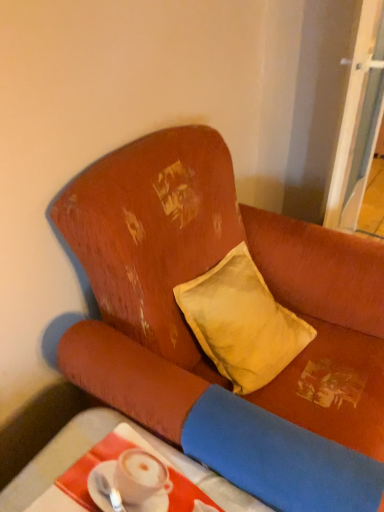
Identify the location of vacant region above smooth white table at lower left (from a real-world perspective). (135, 473).